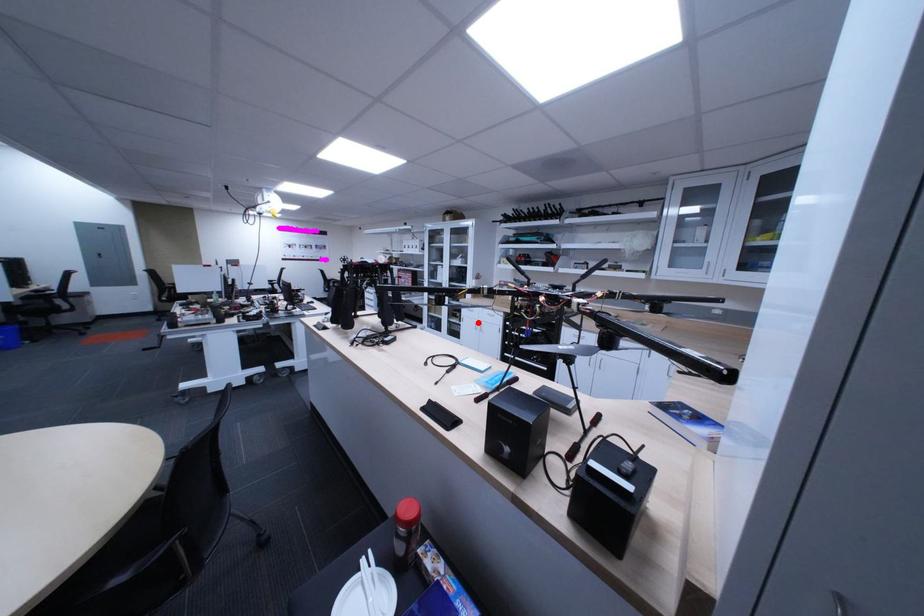
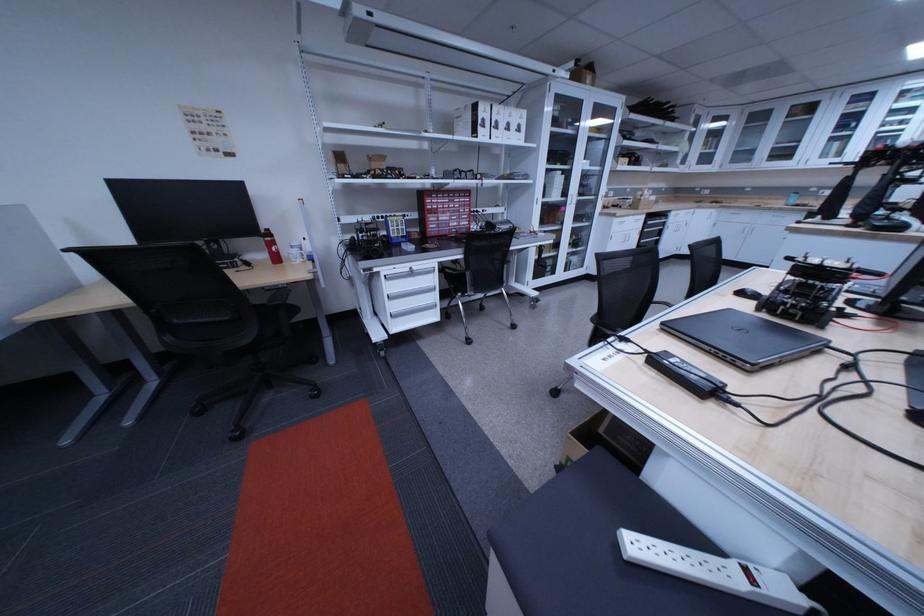
Question: I am providing you with two images of the same scene from different viewpoints. Given a red point in image1, look at the same physical point in image2. Is it:

Choices:
 (A) Closer to the viewpoint
 (B) Farther from the viewpoint

Answer: (A)